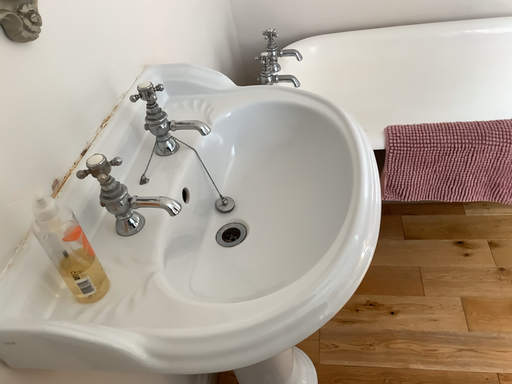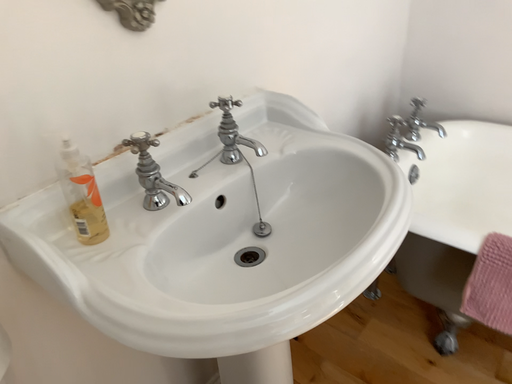
Question: Which way did the camera rotate in the video?

Choices:
 (A) rotated downward
 (B) rotated upward

Answer: (B)